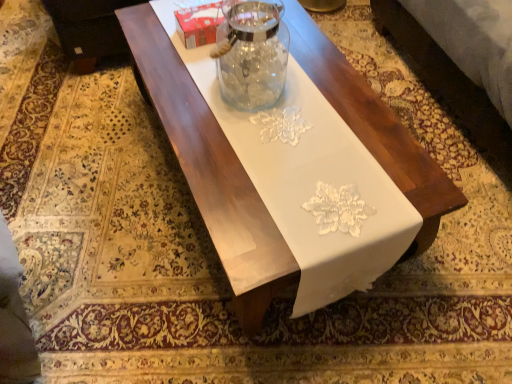
The image size is (512, 384). Find the location of `vacant position to the left of transparent glass jar at center`. vacant position to the left of transparent glass jar at center is located at coordinates (178, 80).